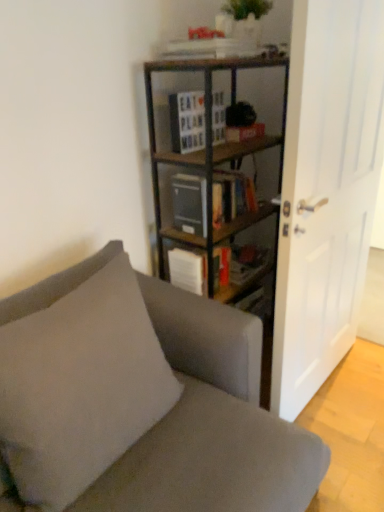
Question: Does white matte door at right contain wooden sign at center, arranged as the 1th book when viewed from the top?

Choices:
 (A) no
 (B) yes

Answer: (A)

Question: Would you consider white matte door at right to be distant from wooden sign at center, arranged as the 1th book when viewed from the top?

Choices:
 (A) yes
 (B) no

Answer: (B)

Question: From a real-world perspective, is white matte door at right positioned over wooden sign at center, arranged as the 1th book when viewed from the top, based on gravity?

Choices:
 (A) yes
 (B) no

Answer: (B)

Question: Considering the relative sizes of white matte door at right and wooden sign at center, arranged as the 1th book when viewed from the top, in the image provided, is white matte door at right smaller than wooden sign at center, arranged as the 1th book when viewed from the top,?

Choices:
 (A) no
 (B) yes

Answer: (A)

Question: Considering the relative positions of white matte door at right and wooden sign at center, arranged as the 1th book when viewed from the top, in the image provided, is white matte door at right to the left of wooden sign at center, arranged as the 1th book when viewed from the top, from the viewer's perspective?

Choices:
 (A) yes
 (B) no

Answer: (B)

Question: Is white matte door at right positioned in front of wooden sign at center, arranged as the 1th book when viewed from the top?

Choices:
 (A) no
 (B) yes

Answer: (B)

Question: Is fabric couch at center oriented away from wooden sign at center, arranged as the 1th book when viewed from the top?

Choices:
 (A) no
 (B) yes

Answer: (A)

Question: From a real-world perspective, is fabric couch at center on wooden sign at center, arranged as the 1th book when viewed from the top?

Choices:
 (A) yes
 (B) no

Answer: (B)

Question: From the image's perspective, is fabric couch at center above wooden sign at center, the 2th book ordered from the bottom?

Choices:
 (A) yes
 (B) no

Answer: (B)

Question: Is fabric couch at center beside wooden sign at center, arranged as the 1th book when viewed from the top?

Choices:
 (A) yes
 (B) no

Answer: (B)

Question: Is fabric couch at center bigger than wooden sign at center, arranged as the 1th book when viewed from the top?

Choices:
 (A) no
 (B) yes

Answer: (B)

Question: Is wooden sign at center, arranged as the 1th book when viewed from the top, surrounded by fabric couch at center?

Choices:
 (A) yes
 (B) no

Answer: (B)

Question: Does wooden sign at center, arranged as the 1th book when viewed from the top, turn towards wooden bookcase at center?

Choices:
 (A) no
 (B) yes

Answer: (B)